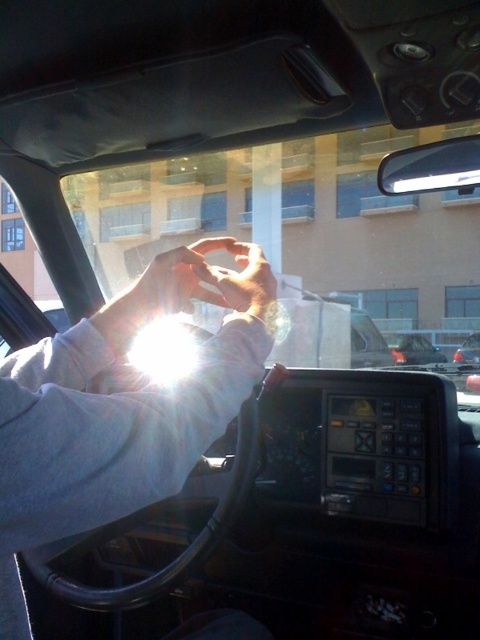
You are a passenger in the vehicle and want to know if you can see the shiny silver sedan at right through the glare from the white matte hands at center. Based on their sizes, can the hands block the view of the sedan?

The white matte hands at center are larger in size than the shiny silver sedan at right, so they can block the view of the shiny silver sedan at right if positioned directly in front of it.

You are a passenger in the vehicle and want to reach the shiny silver sedan at right without touching the white matte hands at center. Which direction should you move your hand?

You should move your hand to the right because the shiny silver sedan at right is to the right of the white matte hands at center.